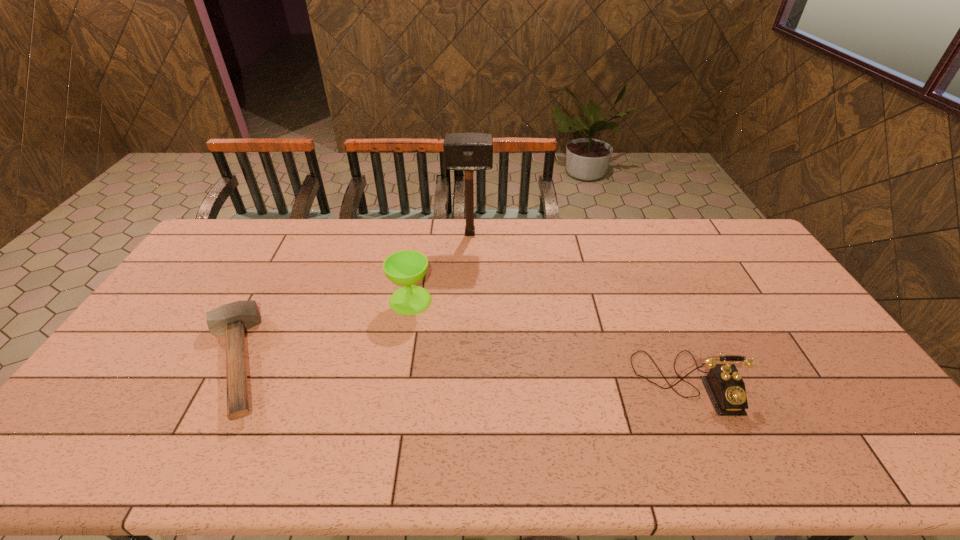
Image resolution: width=960 pixels, height=540 pixels. I want to click on free space located on the dial of the telephone, so click(x=711, y=441).

Find the location of `vacant space located on the back of the left mallet`. vacant space located on the back of the left mallet is located at coordinates (298, 241).

Where is `object present at the far edge`? object present at the far edge is located at coordinates (468, 152).

In the image, there is a desktop. Identify the location of free space at the far edge. (613, 237).

Identify the location of vacant space at the near edge of the desktop. (546, 469).

What are the coordinates of `free space at the left edge` in the screenshot? It's located at (149, 323).

The image size is (960, 540). I want to click on vacant position at the right edge of the desktop, so click(x=774, y=313).

Locate an element on the screen. This screenshot has height=540, width=960. vacant space at the far left corner of the desktop is located at coordinates (233, 238).

Find the location of `vacant space at the far right corner`. vacant space at the far right corner is located at coordinates (732, 237).

Locate an element on the screen. This screenshot has height=540, width=960. vacant area between the nearer mallet and the farthest object is located at coordinates (352, 298).